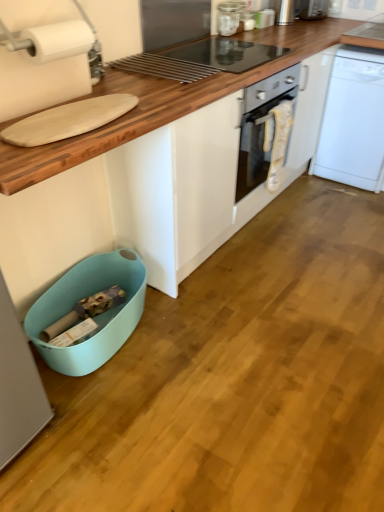
You are a GUI agent. You are given a task and a screenshot of the screen. Output one action in this format:
    pyautogui.click(x=<x>, y=<y>)
    Task: Click on the vacant space in front of satin silver toaster at upper right, marked as the 1th appliance in a back-to-front arrangement
    The image size is (384, 512).
    Given the screenshot: What is the action you would take?
    pyautogui.click(x=312, y=25)